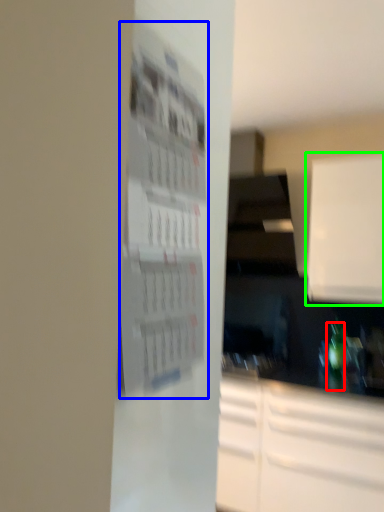
Question: Which is farther away from bottle (highlighted by a red box)? bulletin board (highlighted by a blue box) or cabinetry (highlighted by a green box)?

Choices:
 (A) bulletin board
 (B) cabinetry

Answer: (A)